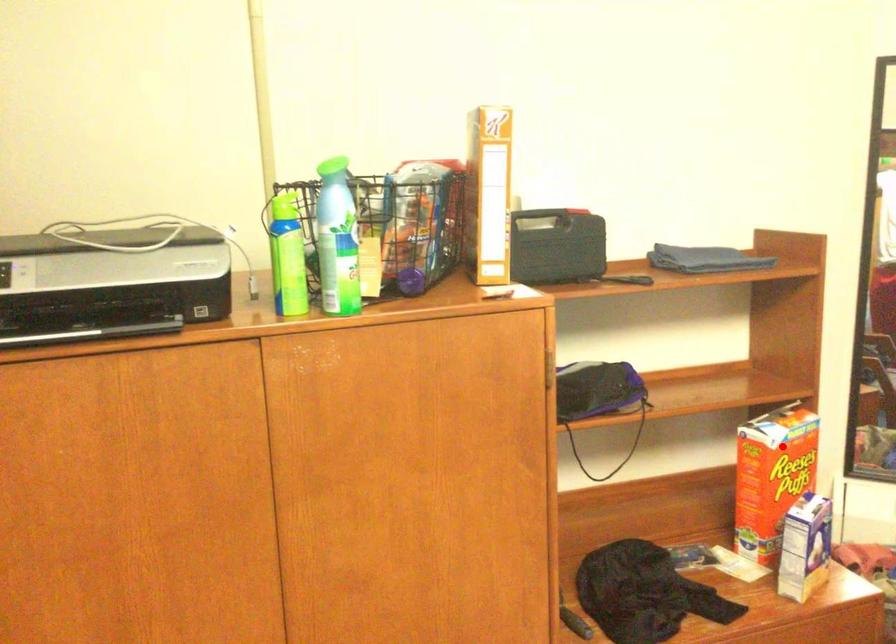
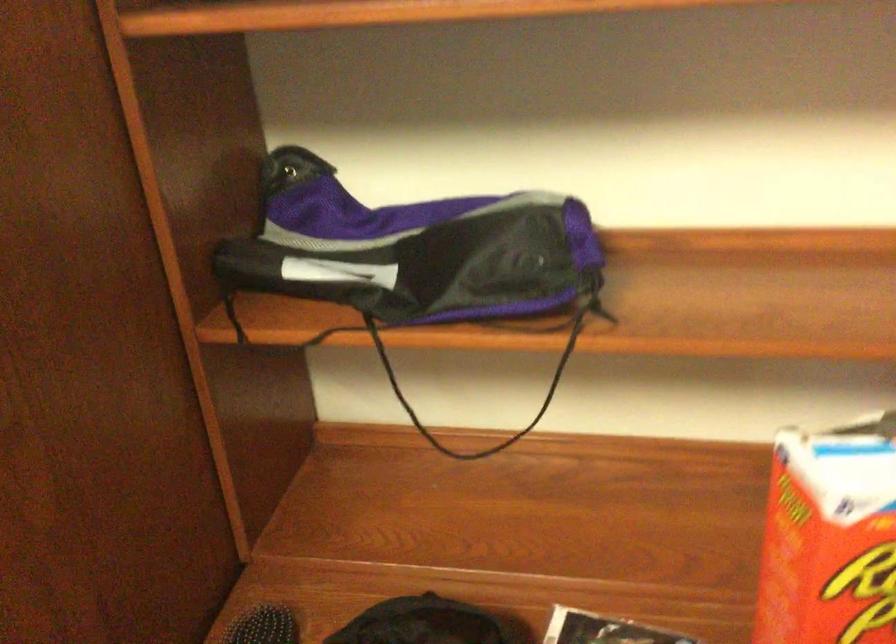
Question: I am providing you with two images of the same scene from different viewpoints. Image1 has a red point marked. In image2, the corresponding 3D location appears at what relative position? Reply with the corresponding letter.

Choices:
 (A) Closer
 (B) Farther

Answer: (A)